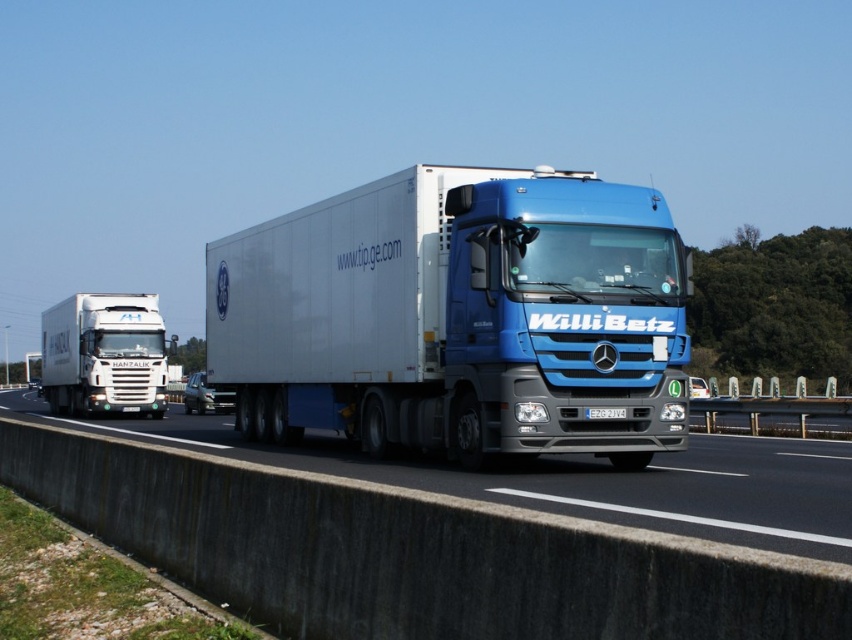
Please provide the coordinates of the blue metallic truck at center in the highway scene.

The blue metallic truck at center is located at coordinates point (573, 477).

You are a photographer trying to capture a clear photo of the blue metallic truck at center and its white plastic license plate at center. Since you want to ensure both are visible, which object should you focus on first to avoid blurring due to their size difference?

The blue metallic truck at center is larger in width than the white plastic license plate at center, so you should focus on the blue metallic truck at center first to ensure it remains sharp while the smaller license plate is still visible.

You are a photographer trying to capture both the blue glossy trailer truck at center and the blue metallic truck at center in a single shot. Given their positions, which truck would require you to zoom in more to ensure it fills the frame adequately?

The blue glossy trailer truck at center has a lesser width compared to the blue metallic truck at center, so you would need to zoom in more on the blue glossy trailer truck at center to fill the frame adequately.